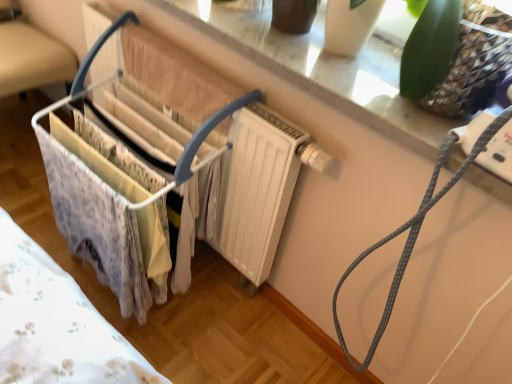
Question: Should I look upward or downward to see gray dotted string at upper right?

Choices:
 (A) up
 (B) down

Answer: (B)

Question: Considering the relative sizes of white glossy window sill at upper center and metallic wire basket at left in the image provided, is white glossy window sill at upper center smaller than metallic wire basket at left?

Choices:
 (A) yes
 (B) no

Answer: (A)

Question: Is white glossy window sill at upper center behind metallic wire basket at left?

Choices:
 (A) no
 (B) yes

Answer: (A)

Question: From the image's perspective, would you say white glossy window sill at upper center is positioned over metallic wire basket at left?

Choices:
 (A) no
 (B) yes

Answer: (A)

Question: Can you confirm if white glossy window sill at upper center is positioned to the left of metallic wire basket at left?

Choices:
 (A) yes
 (B) no

Answer: (B)

Question: Is white glossy window sill at upper center aimed at metallic wire basket at left?

Choices:
 (A) yes
 (B) no

Answer: (B)

Question: Is white glossy window sill at upper center wider than metallic wire basket at left?

Choices:
 (A) no
 (B) yes

Answer: (A)

Question: Considering the relative sizes of metallic wire basket at left and gray dotted string at upper right in the image provided, is metallic wire basket at left wider than gray dotted string at upper right?

Choices:
 (A) yes
 (B) no

Answer: (A)

Question: From the image's perspective, is metallic wire basket at left below gray dotted string at upper right?

Choices:
 (A) no
 (B) yes

Answer: (A)

Question: From a real-world perspective, is metallic wire basket at left positioned under gray dotted string at upper right based on gravity?

Choices:
 (A) yes
 (B) no

Answer: (A)

Question: From the image's perspective, is metallic wire basket at left over gray dotted string at upper right?

Choices:
 (A) no
 (B) yes

Answer: (B)

Question: Can you confirm if metallic wire basket at left is taller than gray dotted string at upper right?

Choices:
 (A) yes
 (B) no

Answer: (B)

Question: From a real-world perspective, is metallic wire basket at left located higher than gray dotted string at upper right?

Choices:
 (A) yes
 (B) no

Answer: (B)

Question: Would you say white plastic baby carriage at left is outside gray dotted string at upper right?

Choices:
 (A) yes
 (B) no

Answer: (A)